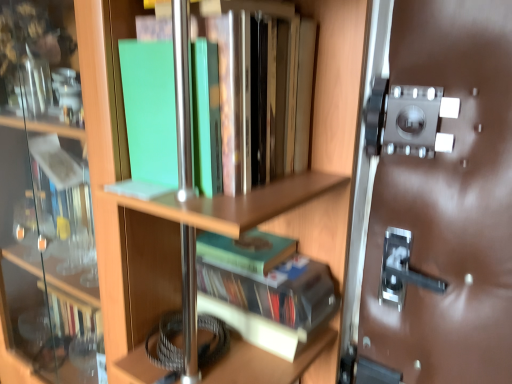
Question: Does green matte book at center, which is the third book in top-to-bottom order, have a lesser height compared to green matte book at upper left, which appears as the 1th book when viewed from the top?

Choices:
 (A) no
 (B) yes

Answer: (B)

Question: Is green matte book at center, which is the third book in top-to-bottom order, to the right of green matte book at upper left, the 3th book positioned from the bottom, from the viewer's perspective?

Choices:
 (A) yes
 (B) no

Answer: (A)

Question: Is green matte book at upper left, the 3th book positioned from the bottom, surrounded by green matte book at center, which is the 1th book from bottom to top?

Choices:
 (A) yes
 (B) no

Answer: (B)

Question: Considering the relative sizes of green matte book at center, which is the third book in top-to-bottom order, and green matte book at upper left, the 3th book positioned from the bottom, in the image provided, is green matte book at center, which is the third book in top-to-bottom order, smaller than green matte book at upper left, the 3th book positioned from the bottom,?

Choices:
 (A) no
 (B) yes

Answer: (B)

Question: Is green matte book at center, which is the third book in top-to-bottom order, with green matte book at upper left, which appears as the 1th book when viewed from the top?

Choices:
 (A) yes
 (B) no

Answer: (B)

Question: Would you say green matte book at center, the second book positioned from the bottom, is to the left or to the right of green matte book at center, which is the third book in top-to-bottom order, in the picture?

Choices:
 (A) left
 (B) right

Answer: (A)

Question: From a real-world perspective, is green matte book at center, the second book positioned from the bottom, above or below green matte book at center, which is the third book in top-to-bottom order?

Choices:
 (A) below
 (B) above

Answer: (B)

Question: Considering their positions, is green matte book at center, acting as the 2th book starting from the top, located in front of or behind green matte book at center, which is the 1th book from bottom to top?

Choices:
 (A) behind
 (B) front

Answer: (A)

Question: Considering the positions of green matte book at center, acting as the 2th book starting from the top, and green matte book at center, which is the 1th book from bottom to top, in the image, is green matte book at center, acting as the 2th book starting from the top, taller or shorter than green matte book at center, which is the 1th book from bottom to top,?

Choices:
 (A) short
 (B) tall

Answer: (A)

Question: Is green matte book at upper left, which appears as the 1th book when viewed from the top, situated inside green matte book at center, which is the third book in top-to-bottom order, or outside?

Choices:
 (A) inside
 (B) outside

Answer: (B)

Question: Considering their positions, is green matte book at upper left, the 3th book positioned from the bottom, located in front of or behind green matte book at center, which is the 1th book from bottom to top?

Choices:
 (A) front
 (B) behind

Answer: (A)

Question: From a real-world perspective, relative to green matte book at center, which is the third book in top-to-bottom order, is green matte book at upper left, the 3th book positioned from the bottom, vertically above or below?

Choices:
 (A) below
 (B) above

Answer: (B)

Question: Considering the positions of green matte book at upper left, which appears as the 1th book when viewed from the top, and green matte book at center, which is the 1th book from bottom to top, in the image, is green matte book at upper left, which appears as the 1th book when viewed from the top, bigger or smaller than green matte book at center, which is the 1th book from bottom to top,?

Choices:
 (A) small
 (B) big

Answer: (B)

Question: Based on their sizes in the image, would you say green matte book at center, which is the third book in top-to-bottom order, is bigger or smaller than green matte book at upper left, which appears as the 1th book when viewed from the top?

Choices:
 (A) small
 (B) big

Answer: (A)

Question: From a real-world perspective, relative to green matte book at upper left, which appears as the 1th book when viewed from the top, is green matte book at center, which is the 1th book from bottom to top, vertically above or below?

Choices:
 (A) below
 (B) above

Answer: (A)